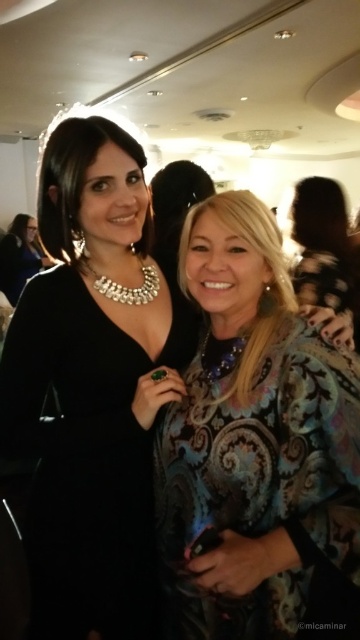
Question: Is patterned fabric dress at center to the right of black velvet dress at center from the viewer's perspective?

Choices:
 (A) no
 (B) yes

Answer: (B)

Question: Which of the following is the closest to the observer?

Choices:
 (A) (69, 276)
 (B) (33, 230)
 (C) (333, 211)

Answer: (A)

Question: Estimate the real-world distances between objects in this image. Which object is closer to the black velvet dress at center?

Choices:
 (A) floral-patterned dress at center
 (B) patterned fabric dress at center
 (C) matte black dress at center

Answer: (B)

Question: Is black velvet dress at center to the left of floral-patterned dress at center from the viewer's perspective?

Choices:
 (A) yes
 (B) no

Answer: (A)

Question: Does black velvet dress at center have a larger size compared to matte black dress at center?

Choices:
 (A) yes
 (B) no

Answer: (B)

Question: Which point is farther to the camera?

Choices:
 (A) (156, 602)
 (B) (38, 259)
 (C) (312, 467)

Answer: (B)